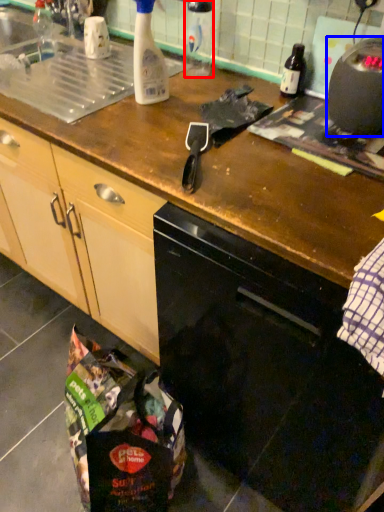
Question: Which of the following is the farthest to the observer, bottle (highlighted by a red box) or kitchen appliance (highlighted by a blue box)?

Choices:
 (A) bottle
 (B) kitchen appliance

Answer: (A)